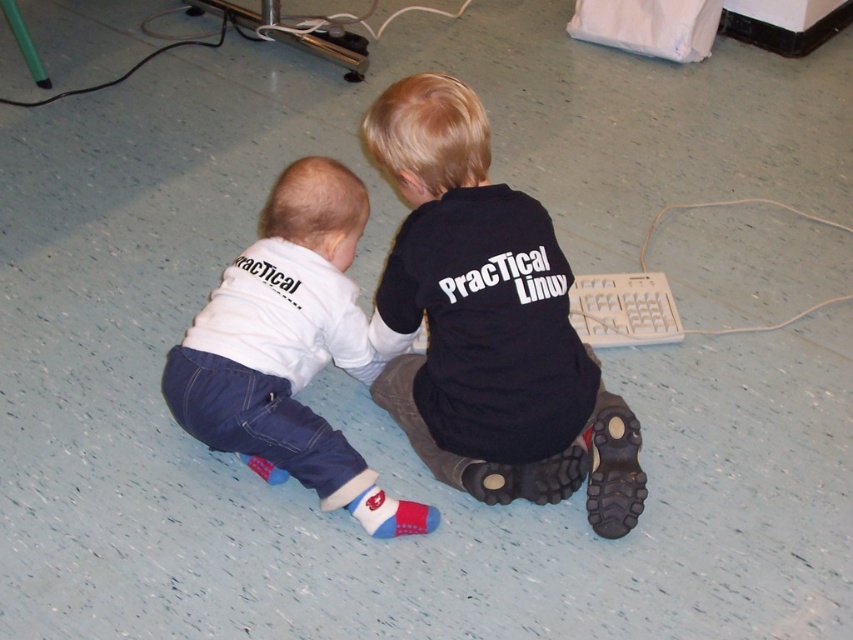
Describe the element at coordinates (488, 323) in the screenshot. I see `black matte shirt at center` at that location.

Can you confirm if black matte shirt at center is positioned to the right of white cotton shirt at lower left?

Yes, black matte shirt at center is to the right of white cotton shirt at lower left.

Is point (474, 355) closer to camera compared to point (335, 216)?

Yes.

The image size is (853, 640). What are the coordinates of `black matte shirt at center` in the screenshot? It's located at (488, 323).